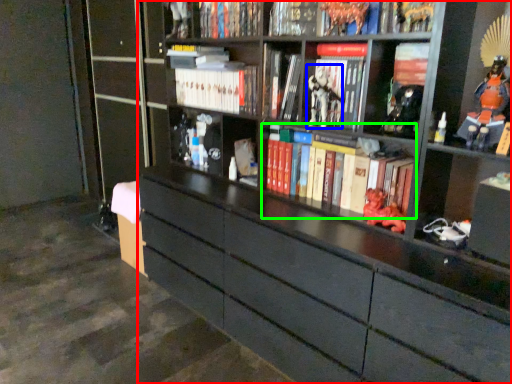
Question: Which object is positioned farthest from bookcase (highlighted by a red box)? Select from comic book character (highlighted by a blue box) and book (highlighted by a green box).

Choices:
 (A) comic book character
 (B) book

Answer: (A)